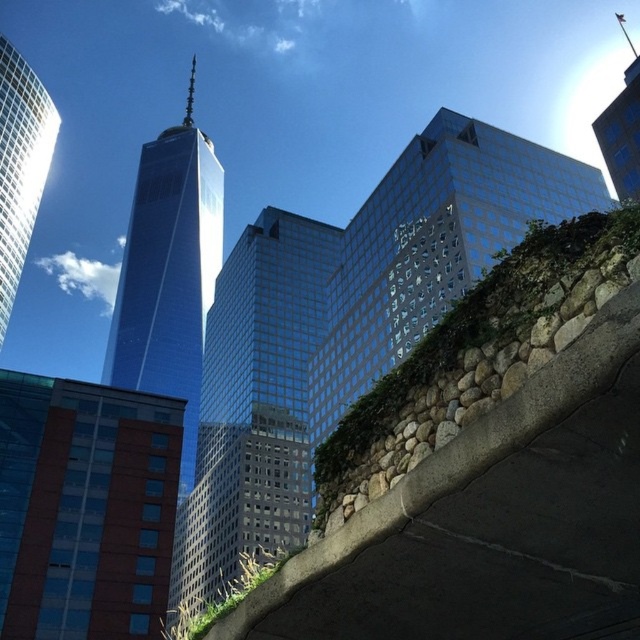
You are a delivery driver trying to navigate through the city. You need to drive your truck, which is 2.5 meters wide, under the stone concrete overpass at center and past the brown brick building at lower left. Based on the scene, can your truck fit under the overpass and around the building?

The stone concrete overpass at center has a lesser width compared to the brown brick building at lower left. Since the overpass is narrower than the brick building, but the truck is only 2.5 meters wide, it depends on the actual width of the overpass. However, the description only states the overpass is narrower than the brick building, not its exact width. Without specific measurements, we cannot confirm if the truck will fit. Please check the overpass width before proceeding.

You are standing at a viewpoint in the city and see two points in the scene. The first point is labeled as point [403,266] and the second is point [170,381]. Which point is closer to you?

Point [403,266] is in front of point [170,381], so it is closer to you.